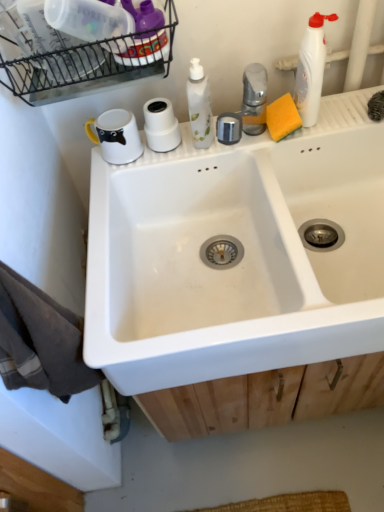
Question: Based on their sizes in the image, would you say white ceramic sink at center is bigger or smaller than white matte toilet paper at upper center?

Choices:
 (A) big
 (B) small

Answer: (A)

Question: Is white ceramic sink at center in front of or behind white matte toilet paper at upper center in the image?

Choices:
 (A) behind
 (B) front

Answer: (B)

Question: Estimate the real-world distances between objects in this image. Which object is closer to the white matte toilet paper at upper center?

Choices:
 (A) yellow sponge at upper right
 (B) white plastic bottle at upper right
 (C) white ceramic sink at center
 (D) black wire basket at upper left

Answer: (D)

Question: Which object is positioned closest to the white plastic bottle at upper right?

Choices:
 (A) black wire basket at upper left
 (B) white matte toilet paper at upper center
 (C) yellow sponge at upper right
 (D) white ceramic sink at center

Answer: (C)